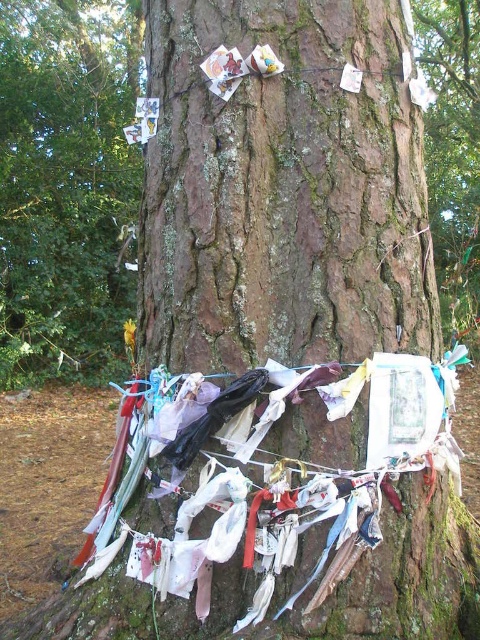
Question: Based on their relative distances, which object is nearer to the brown rough bark at center?

Choices:
 (A) multicolored fabric at center
 (B) rough bark tree at upper center

Answer: (A)

Question: Does brown rough bark at center appear under rough bark tree at upper center?

Choices:
 (A) no
 (B) yes

Answer: (B)

Question: Can you confirm if rough bark tree at upper center is positioned above multicolored fabric at center?

Choices:
 (A) no
 (B) yes

Answer: (B)

Question: Does brown rough bark at center appear under rough bark tree at upper center?

Choices:
 (A) yes
 (B) no

Answer: (A)

Question: Which object is positioned closest to the multicolored fabric at center?

Choices:
 (A) rough bark tree at upper center
 (B) brown rough bark at center

Answer: (B)

Question: Which of these objects is positioned closest to the multicolored fabric at center?

Choices:
 (A) rough bark tree at upper center
 (B) brown rough bark at center

Answer: (B)